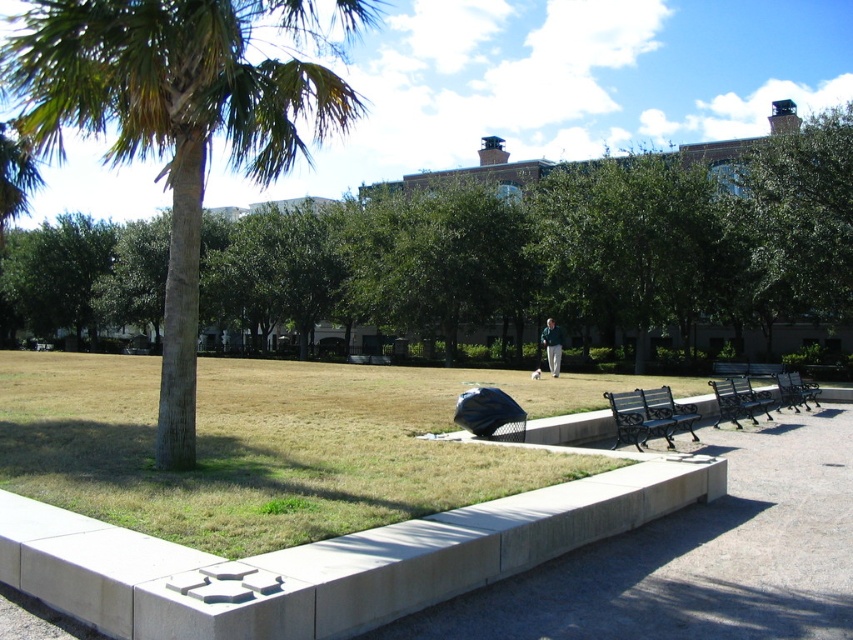
You are planning to place a new bench in the park. The existing black wrought iron bench at lower right is currently in the way. How does the width of the existing bench compare to the light brown leather jacket at center?

The black wrought iron bench at lower right is thinner than the light brown leather jacket at center, so the existing bench is narrower in width compared to the jacket.